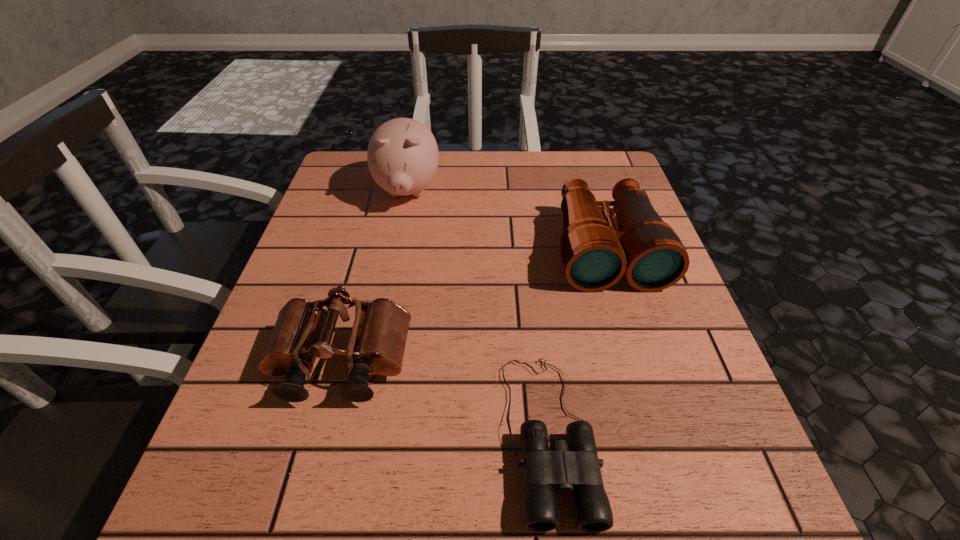
Identify the location of piggy bank. This screenshot has width=960, height=540. (402, 155).

The height and width of the screenshot is (540, 960). In order to click on the farthest binoculars in this screenshot , I will do pyautogui.click(x=595, y=255).

Locate an element on the screen. the leftmost binoculars is located at coordinates (303, 331).

This screenshot has height=540, width=960. I want to click on the shortest binoculars, so coord(578,470).

I want to click on vacant region located 0.370m at the snout of the tallest object, so click(x=376, y=347).

Identify the location of vacant space positioned through the lenses of the farthest binoculars. Image resolution: width=960 pixels, height=540 pixels. (629, 325).

The image size is (960, 540). What are the coordinates of `vacant space located through the eyepieces of the leftmost binoculars` in the screenshot? It's located at (317, 460).

In order to click on object located at the far edge in this screenshot , I will do (402, 155).

At what (x,y) coordinates should I click in order to perform the action: click on object present at the near edge. Please return your answer as a coordinate pair (x, y). The width and height of the screenshot is (960, 540). Looking at the image, I should click on (578, 470).

Where is `piggy bank located in the left edge section of the desktop`? The image size is (960, 540). piggy bank located in the left edge section of the desktop is located at coordinates (402, 155).